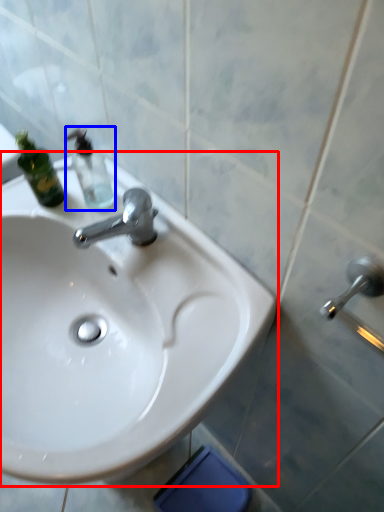
Question: Which object is further to the camera taking this photo, sink (highlighted by a red box) or bottle (highlighted by a blue box)?

Choices:
 (A) sink
 (B) bottle

Answer: (B)